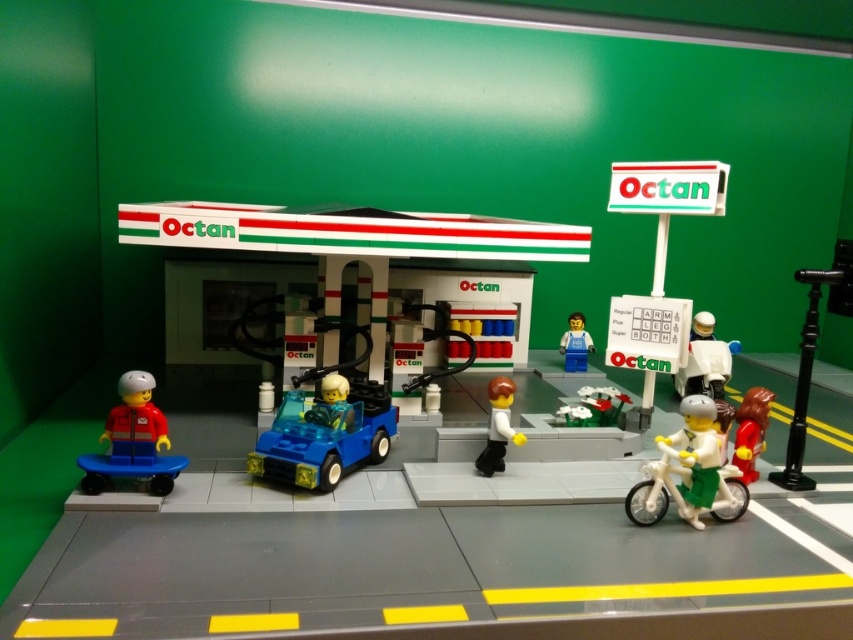
From the picture: You are standing at the gas station and want to know how far the point marked at coordinates (x=334, y=392) is from your current position. Can you determine the distance?

The point marked at coordinates (x=334, y=392) is 5.94 feet away from your current position.

You are a delivery robot trying to navigate through the LEGO gas station scene. You need to move from the smooth red bicycle at lower right to the matte red minifigure at lower left. Can you pass underneath the Octan canopy without hitting your head?

The matte red minifigure at lower left is above the smooth red bicycle at lower right, which means the minifigure is positioned higher. Since the Octan canopy is part of the gas station structure, the vertical clearance under the canopy should accommodate standard LEGO figures and vehicles. Therefore, the delivery robot can safely pass underneath the Octan canopy without hitting its head.

You are a drone operator trying to deliver a package to the gas station. You need to fly your drone from the point at coordinates point (148, 390) to the point at coordinates point (753, 426). Which point should you start your flight from?

You should start your flight from point (148, 390) because it is in front of point (753, 426), meaning it is closer to the starting position.